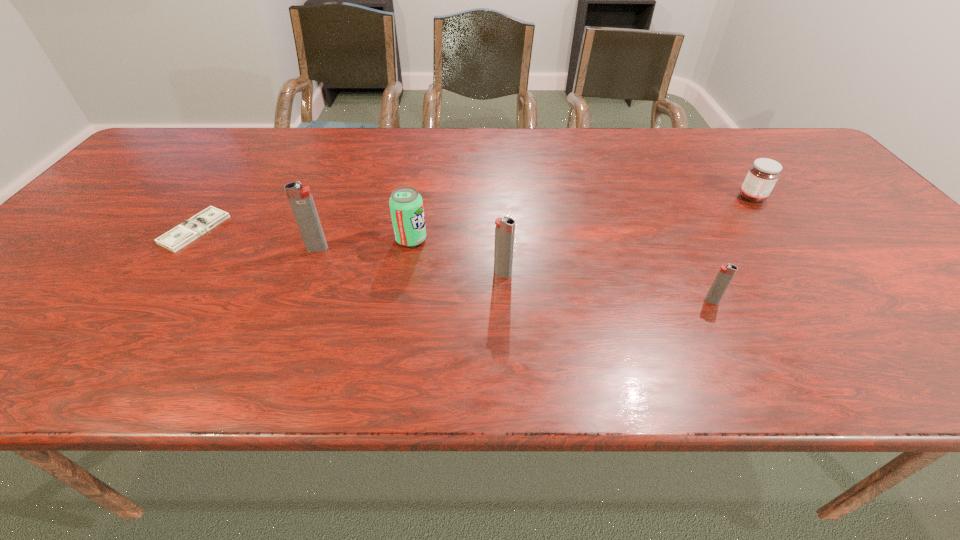
Considering the uniform spacing of igniters, where should an additional igniter be positioned on the right? Please locate a free spot. Please provide its 2D coordinates. Your answer should be formatted as a tuple, i.e. [(x, y)], where the tuple contains the x and y coordinates of a point satisfying the conditions above.

[(949, 333)]